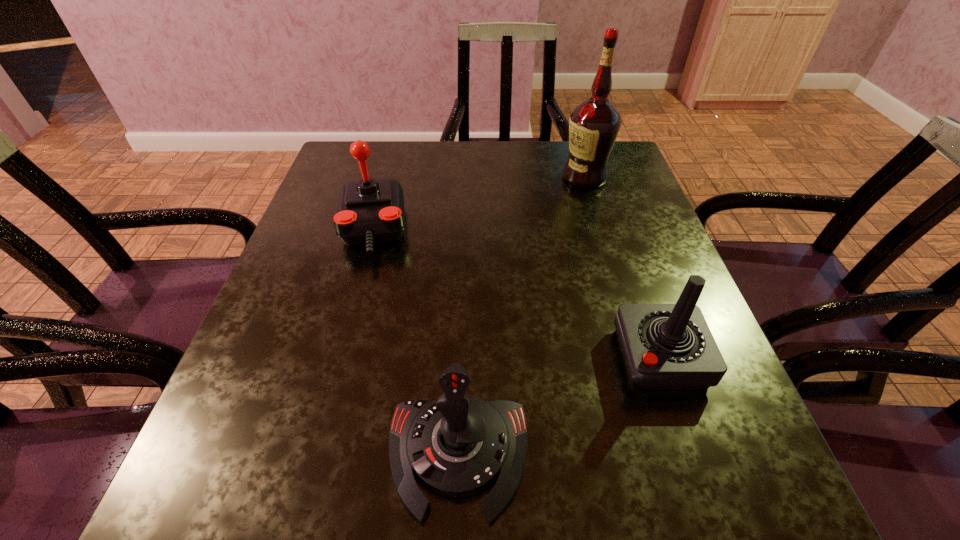
Where is `free region located 0.090m on the label of the tallest object`? free region located 0.090m on the label of the tallest object is located at coordinates (528, 177).

Identify the location of blank area located 0.110m on the right of the farthest joystick. The image size is (960, 540). (457, 230).

Find the location of a particular element. This screenshot has width=960, height=540. vacant space located 0.370m on the front-facing side of the second nearest joystick is located at coordinates (404, 357).

This screenshot has width=960, height=540. Identify the location of vacant space positioned 0.360m on the front-facing side of the second nearest joystick. (410, 357).

You are a GUI agent. You are given a task and a screenshot of the screen. Output one action in this format:
    pyautogui.click(x=<x>, y=<y>)
    Task: Click on the free space located 0.360m on the front-facing side of the second nearest joystick
    The width and height of the screenshot is (960, 540).
    Given the screenshot: What is the action you would take?
    pyautogui.click(x=410, y=357)

I want to click on object that is at the far edge, so click(x=594, y=125).

Identify the location of object present at the near edge. This screenshot has width=960, height=540. pos(458,445).

This screenshot has height=540, width=960. I want to click on object that is at the left edge, so click(370, 211).

The width and height of the screenshot is (960, 540). Identify the location of alcohol situated at the right edge. (594, 125).

The height and width of the screenshot is (540, 960). I want to click on joystick located at the right edge, so click(x=665, y=346).